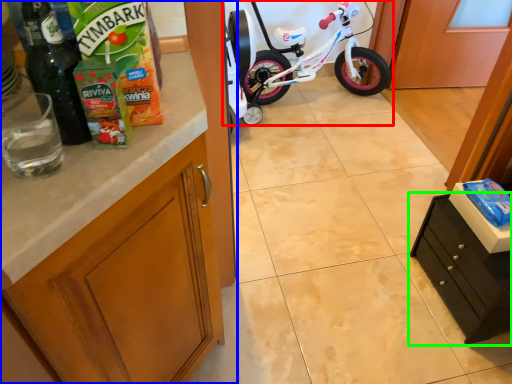
Question: Which object is the closest to the bicycle (highlighted by a red box)? Choose among these: cabinetry (highlighted by a blue box) or cabinetry (highlighted by a green box).

Choices:
 (A) cabinetry
 (B) cabinetry

Answer: (B)